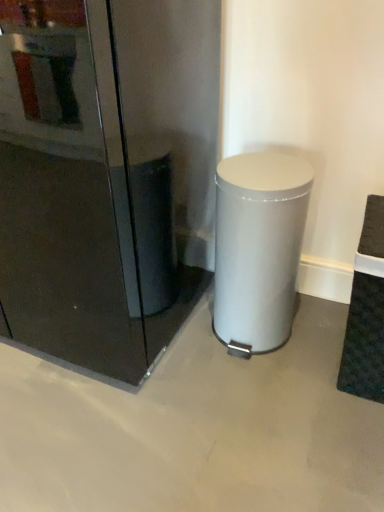
Question: Is satin silver trash can at center at the back of glossy black fridge at center?

Choices:
 (A) no
 (B) yes

Answer: (A)

Question: Is glossy black fridge at center thinner than satin silver trash can at center?

Choices:
 (A) yes
 (B) no

Answer: (B)

Question: From a real-world perspective, is glossy black fridge at center located higher than satin silver trash can at center?

Choices:
 (A) yes
 (B) no

Answer: (A)

Question: Is glossy black fridge at center not inside satin silver trash can at center?

Choices:
 (A) no
 (B) yes

Answer: (B)

Question: Can you confirm if glossy black fridge at center is positioned to the right of satin silver trash can at center?

Choices:
 (A) yes
 (B) no

Answer: (B)

Question: From the image's perspective, is glossy black fridge at center on satin silver trash can at center?

Choices:
 (A) yes
 (B) no

Answer: (A)

Question: Is satin silver trash can at center bigger than glossy black fridge at center?

Choices:
 (A) yes
 (B) no

Answer: (B)

Question: Does satin silver trash can at center have a greater width compared to glossy black fridge at center?

Choices:
 (A) no
 (B) yes

Answer: (A)

Question: Is the position of satin silver trash can at center less distant than that of glossy black fridge at center?

Choices:
 (A) no
 (B) yes

Answer: (A)

Question: Is glossy black fridge at center surrounded by satin silver trash can at center?

Choices:
 (A) no
 (B) yes

Answer: (A)

Question: Considering the relative positions of satin silver trash can at center and glossy black fridge at center in the image provided, is satin silver trash can at center to the left of glossy black fridge at center from the viewer's perspective?

Choices:
 (A) no
 (B) yes

Answer: (A)

Question: Is satin silver trash can at center positioned with its back to glossy black fridge at center?

Choices:
 (A) yes
 (B) no

Answer: (B)

Question: Considering the positions of point pos(41,348) and point pos(236,343), is point pos(41,348) closer or farther from the camera than point pos(236,343)?

Choices:
 (A) closer
 (B) farther

Answer: (B)